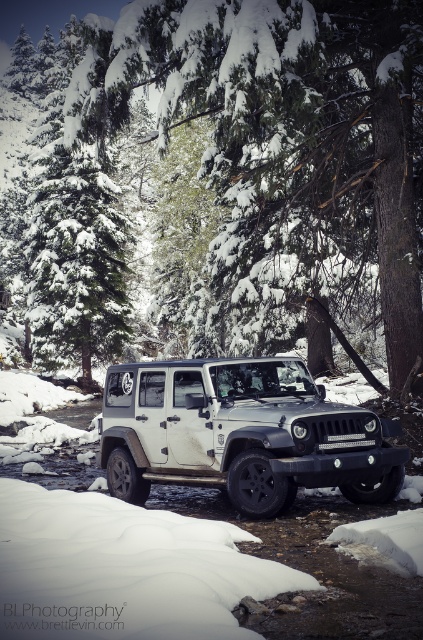
You are standing in front of the Jeep Wrangler in the snowy forest. You notice two points marked on the vehicle. The first point is at coordinates point (x=362, y=116) and the second is at point (x=33, y=70). Which of these points is closer to you?

Point (x=362, y=116) is closer to the viewer than point (x=33, y=70).